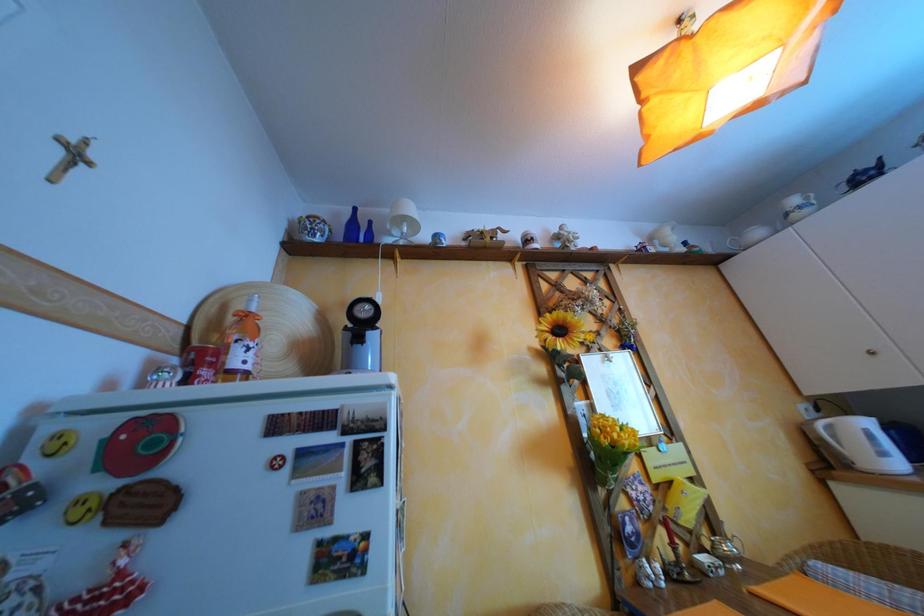
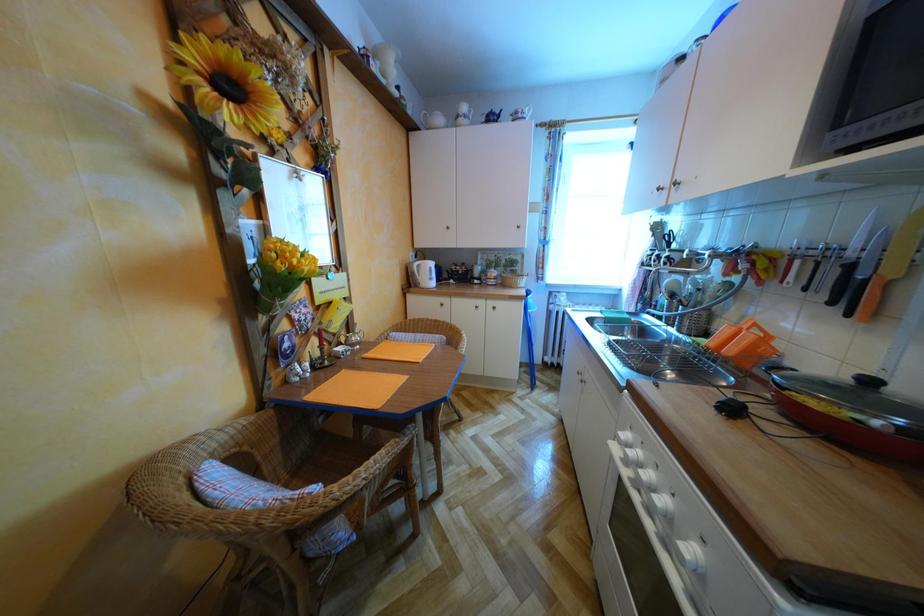
Based on the continuous images, in which direction is the camera rotating?

The rotation direction of the camera is right-down.